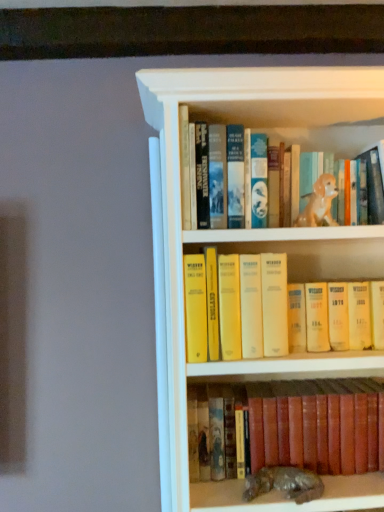
Question: Based on their sizes in the image, would you say leather-bound book at lower center, which is the 1th book in bottom-to-top order, is bigger or smaller than yellow paperbacks at center, the 2th book positioned from the bottom?

Choices:
 (A) big
 (B) small

Answer: (A)

Question: In terms of height, does leather-bound book at lower center, which ranks as the second book in top-to-bottom order, look taller or shorter compared to yellow paperbacks at center, acting as the first book starting from the top?

Choices:
 (A) tall
 (B) short

Answer: (B)

Question: Estimate the real-world distances between objects in this image. Which object is farther from the shiny metallic statue at lower center, which is the 1th animal in bottom-to-top order?

Choices:
 (A) leather-bound book at lower center, which ranks as the second book in top-to-bottom order
 (B) golden ceramic dog at upper center, which is the 2th animal in bottom-to-top order
 (C) yellow paperbacks at center, the 2th book positioned from the bottom

Answer: (B)

Question: Which object is the closest to the golden ceramic dog at upper center, acting as the 1th animal starting from the top?

Choices:
 (A) leather-bound book at lower center, which ranks as the second book in top-to-bottom order
 (B) yellow paperbacks at center, the 2th book positioned from the bottom
 (C) shiny metallic statue at lower center, which is the second animal in top-to-bottom order

Answer: (B)